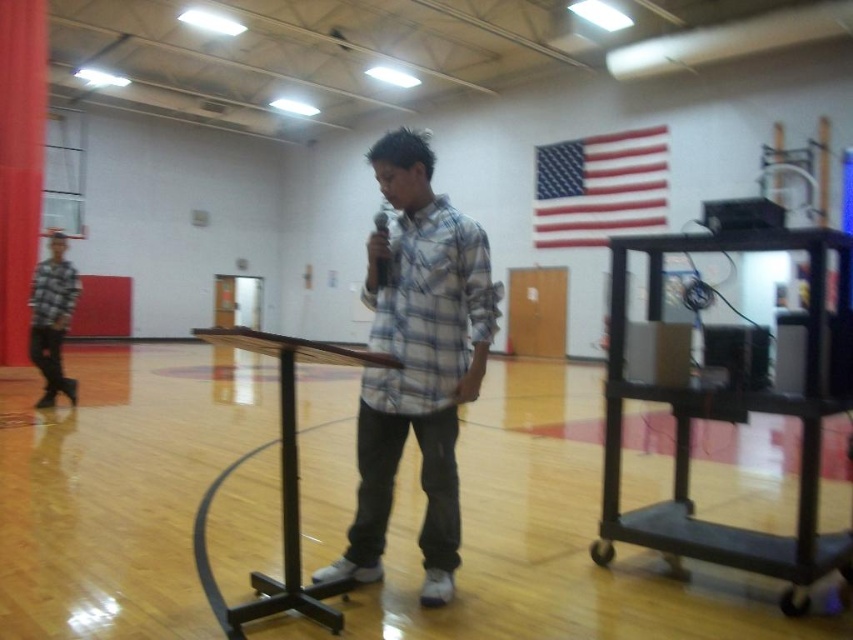
Which is more to the right, red velvet curtain at left or brown wood podium at center?

Positioned to the right is brown wood podium at center.

In the scene shown: Between red velvet curtain at left and brown wood podium at center, which one appears on the left side from the viewer's perspective?

From the viewer's perspective, red velvet curtain at left appears more on the left side.

Who is more distant from viewer, (13, 106) or (291, 497)?

Point (13, 106)

Image resolution: width=853 pixels, height=640 pixels. Find the location of `red velvet curtain at left`. red velvet curtain at left is located at coordinates (19, 163).

From the picture: Which is below, plaid shirt at center or red velvet curtain at left?

plaid shirt at center

Find the location of `plaid shirt at center`. plaid shirt at center is located at coordinates (416, 362).

Find the location of a particular element. plaid shirt at center is located at coordinates (416, 362).

Who is higher up, plaid shirt at center or plaid shirt at left?

Positioned higher is plaid shirt at left.

Does plaid shirt at center appear over plaid shirt at left?

No.

The height and width of the screenshot is (640, 853). What do you see at coordinates (416, 362) in the screenshot? I see `plaid shirt at center` at bounding box center [416, 362].

Identify the location of plaid shirt at center. (416, 362).